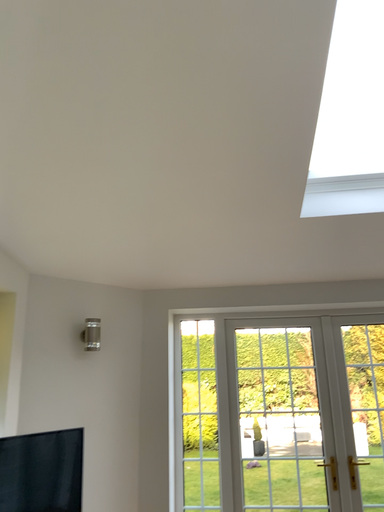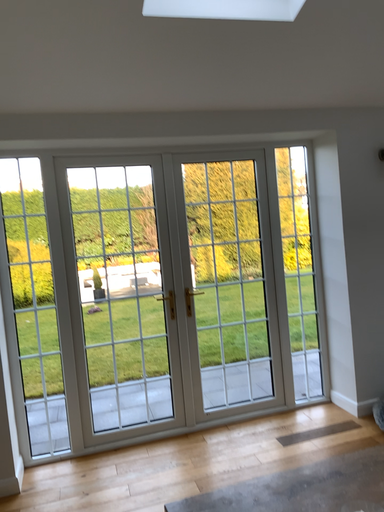
Question: How did the camera likely rotate when shooting the video?

Choices:
 (A) rotated left
 (B) rotated right

Answer: (B)